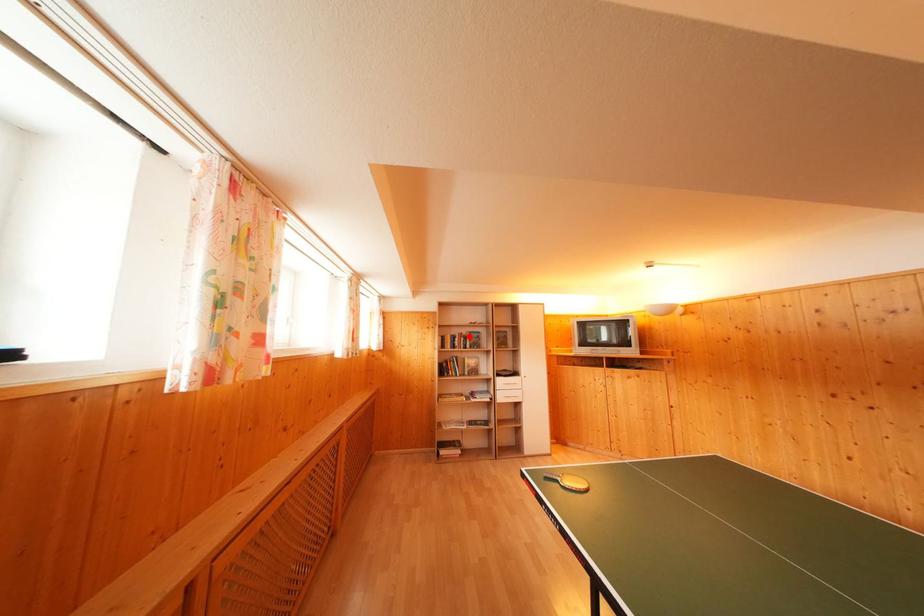
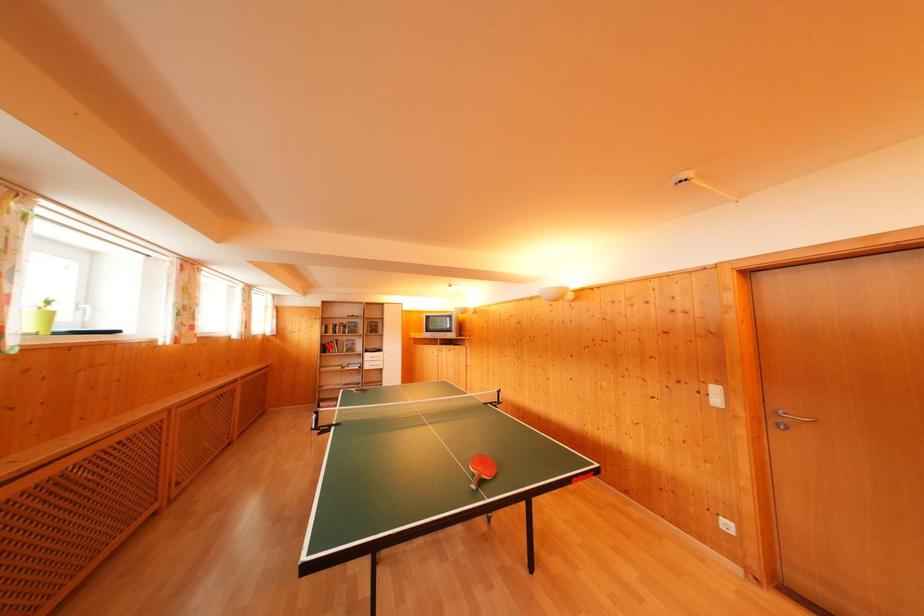
I am providing you with two images of the same scene from different viewpoints. A red point is marked on the first image and another point is marked on the second image. Do the highlighted points in image1 and image2 indicate the same real-world spot?

No